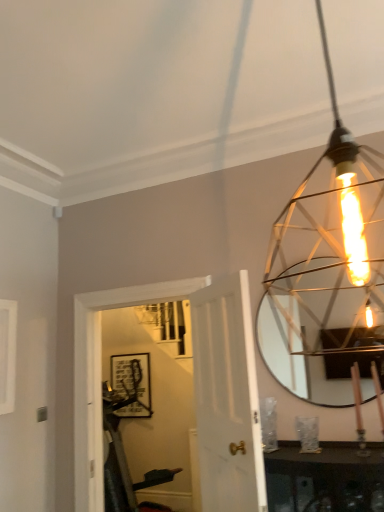
Question: From a real-world perspective, is matte black picture frame at center over matte gold wire cage at upper right?

Choices:
 (A) no
 (B) yes

Answer: (A)

Question: Is matte black picture frame at center not within matte gold wire cage at upper right?

Choices:
 (A) no
 (B) yes

Answer: (B)

Question: Considering the relative sizes of matte black picture frame at center and matte gold wire cage at upper right in the image provided, is matte black picture frame at center bigger than matte gold wire cage at upper right?

Choices:
 (A) no
 (B) yes

Answer: (A)

Question: From the image's perspective, would you say matte black picture frame at center is positioned over matte gold wire cage at upper right?

Choices:
 (A) yes
 (B) no

Answer: (B)

Question: Considering the relative sizes of matte black picture frame at center and matte gold wire cage at upper right in the image provided, is matte black picture frame at center wider than matte gold wire cage at upper right?

Choices:
 (A) yes
 (B) no

Answer: (B)

Question: Is matte gold wire cage at upper right inside the boundaries of metallic silver mirror at upper right, or outside?

Choices:
 (A) outside
 (B) inside

Answer: (A)

Question: Considering the positions of matte gold wire cage at upper right and metallic silver mirror at upper right in the image, is matte gold wire cage at upper right wider or thinner than metallic silver mirror at upper right?

Choices:
 (A) wide
 (B) thin

Answer: (A)

Question: Is matte gold wire cage at upper right to the left or to the right of metallic silver mirror at upper right in the image?

Choices:
 (A) left
 (B) right

Answer: (A)

Question: From the image's perspective, is matte gold wire cage at upper right located above or below metallic silver mirror at upper right?

Choices:
 (A) below
 (B) above

Answer: (B)

Question: From a real-world perspective, relative to white wood door at center, is matte gold wire cage at upper right vertically above or below?

Choices:
 (A) above
 (B) below

Answer: (A)

Question: Would you say matte gold wire cage at upper right is to the left or to the right of white wood door at center in the picture?

Choices:
 (A) left
 (B) right

Answer: (B)

Question: Looking at the image, does matte gold wire cage at upper right seem bigger or smaller compared to white wood door at center?

Choices:
 (A) small
 (B) big

Answer: (A)

Question: Do you think matte gold wire cage at upper right is within white wood door at center, or outside of it?

Choices:
 (A) outside
 (B) inside

Answer: (A)

Question: In the image, is metallic silver mirror at upper right positioned in front of or behind white wood door at center?

Choices:
 (A) front
 (B) behind

Answer: (B)

Question: In terms of size, does metallic silver mirror at upper right appear bigger or smaller than white wood door at center?

Choices:
 (A) big
 (B) small

Answer: (B)